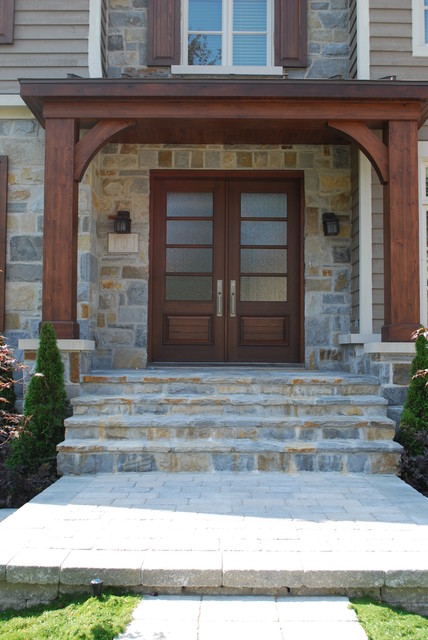
Identify the location of windows. The image size is (428, 640). (187, 255), (264, 259).